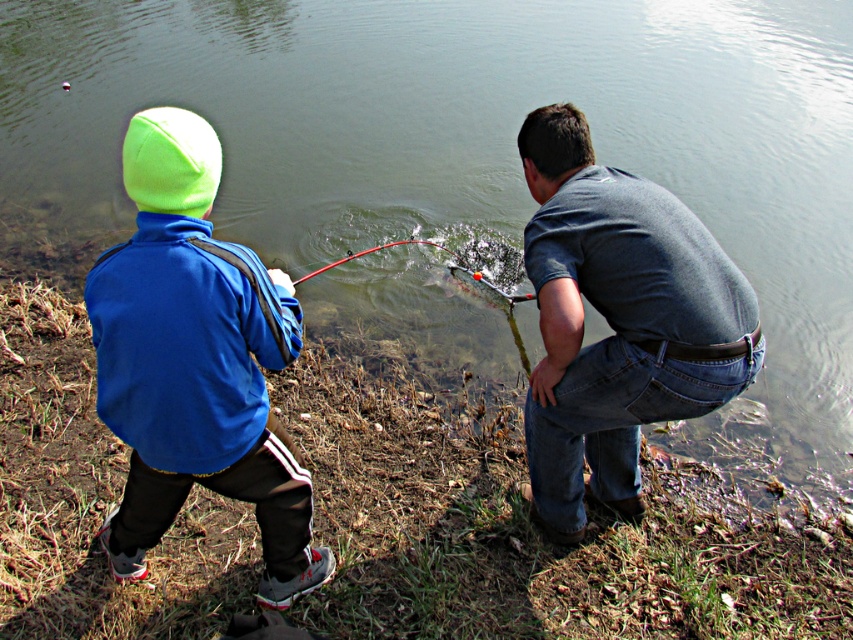
Question: Based on their relative distances, which object is nearer to the shiny metallic rod at center?

Choices:
 (A) matte blue jacket at left
 (B) blue fleece jacket at left

Answer: (A)

Question: Can you confirm if matte blue jacket at left is thinner than shiny metallic rod at center?

Choices:
 (A) no
 (B) yes

Answer: (B)

Question: Is blue fleece jacket at left above shiny metallic rod at center?

Choices:
 (A) no
 (B) yes

Answer: (A)

Question: Which point is farther to the camera?

Choices:
 (A) matte blue jacket at left
 (B) shiny metallic rod at center

Answer: (B)

Question: Does denim jeans at lower right come in front of shiny metallic rod at center?

Choices:
 (A) no
 (B) yes

Answer: (B)

Question: Based on their relative distances, which object is farther from the matte blue jacket at left?

Choices:
 (A) denim jeans at lower right
 (B) blue fleece jacket at left
 (C) shiny metallic rod at center

Answer: (C)